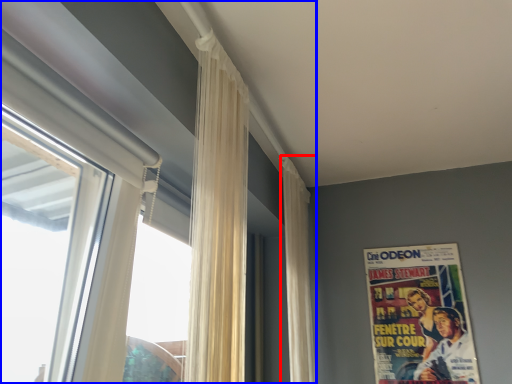
Question: Which point is further to the camera, curtain (highlighted by a red box) or window (highlighted by a blue box)?

Choices:
 (A) curtain
 (B) window

Answer: (A)